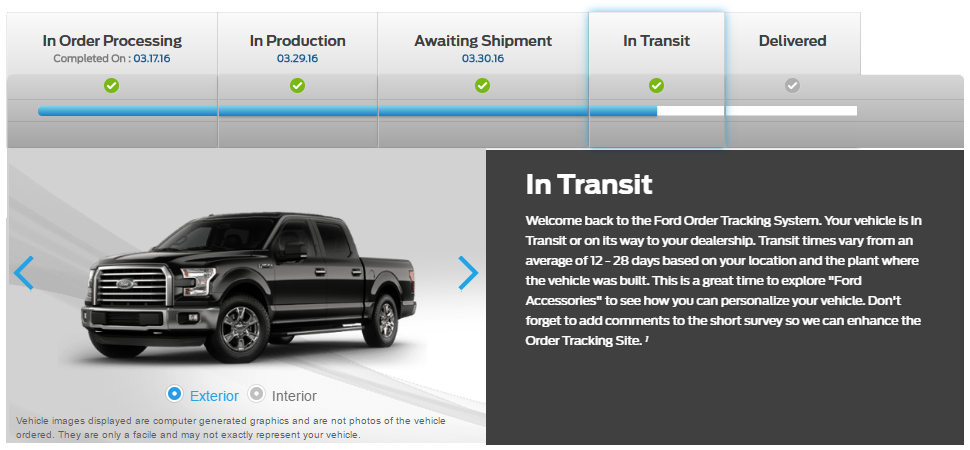
Find the location of a particular element. right doors is located at coordinates (304, 283), (340, 280).